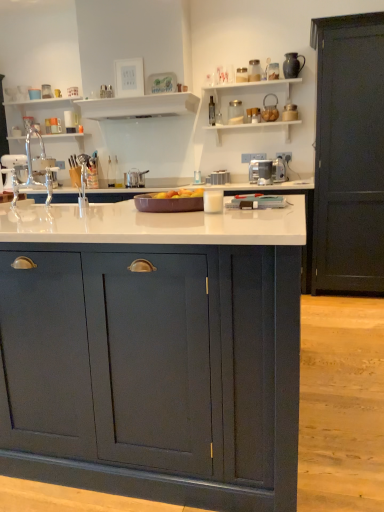
Question: Which direction should I rotate to look at satin silver toaster at center, which ranks as the third appliance in back-to-front order, — up or down?

Choices:
 (A) down
 (B) up

Answer: (B)

Question: Considering the relative sizes of satin silver pot at center, acting as the 1th appliance starting from the left, and metallic silver toaster at center, positioned as the 3th appliance in front-to-back order, in the image provided, is satin silver pot at center, acting as the 1th appliance starting from the left, smaller than metallic silver toaster at center, positioned as the 3th appliance in front-to-back order,?

Choices:
 (A) yes
 (B) no

Answer: (B)

Question: From the image's perspective, is satin silver pot at center, acting as the 1th appliance starting from the left, below metallic silver toaster at center, positioned as the 2th appliance in left-to-right order?

Choices:
 (A) yes
 (B) no

Answer: (A)

Question: Does satin silver pot at center, which appears as the 3th appliance when viewed from the right, appear on the left side of metallic silver toaster at center, positioned as the 3th appliance in front-to-back order?

Choices:
 (A) no
 (B) yes

Answer: (B)

Question: Is satin silver pot at center, which appears as the 3th appliance when viewed from the right, wider than metallic silver toaster at center, positioned as the 2th appliance in left-to-right order?

Choices:
 (A) yes
 (B) no

Answer: (A)

Question: Is satin silver pot at center, arranged as the second appliance when viewed from the back, thinner than metallic silver toaster at center, positioned as the 2th appliance in right-to-left order?

Choices:
 (A) no
 (B) yes

Answer: (A)

Question: Is satin silver pot at center, which appears as the 3th appliance when viewed from the right, far from metallic silver toaster at center, placed as the first appliance when sorted from back to front?

Choices:
 (A) yes
 (B) no

Answer: (B)

Question: Considering the relative sizes of metallic silver toaster at center, placed as the first appliance when sorted from back to front, and transparent glass bottle at upper center in the image provided, is metallic silver toaster at center, placed as the first appliance when sorted from back to front, taller than transparent glass bottle at upper center?

Choices:
 (A) no
 (B) yes

Answer: (A)

Question: Can you confirm if metallic silver toaster at center, placed as the first appliance when sorted from back to front, is wider than transparent glass bottle at upper center?

Choices:
 (A) no
 (B) yes

Answer: (B)

Question: Is metallic silver toaster at center, positioned as the 3th appliance in front-to-back order, not inside transparent glass bottle at upper center?

Choices:
 (A) no
 (B) yes

Answer: (B)

Question: Is metallic silver toaster at center, positioned as the 2th appliance in left-to-right order, oriented towards transparent glass bottle at upper center?

Choices:
 (A) no
 (B) yes

Answer: (A)

Question: Is metallic silver toaster at center, positioned as the 2th appliance in right-to-left order, with transparent glass bottle at upper center?

Choices:
 (A) yes
 (B) no

Answer: (B)

Question: Is metallic silver toaster at center, positioned as the 2th appliance in right-to-left order, at the left side of transparent glass bottle at upper center?

Choices:
 (A) yes
 (B) no

Answer: (B)

Question: Can you see metallic silver toaster at center, placed as the first appliance when sorted from back to front, touching white glossy shelf at upper center, marked as the 2th shelf in a left-to-right arrangement?

Choices:
 (A) yes
 (B) no

Answer: (B)